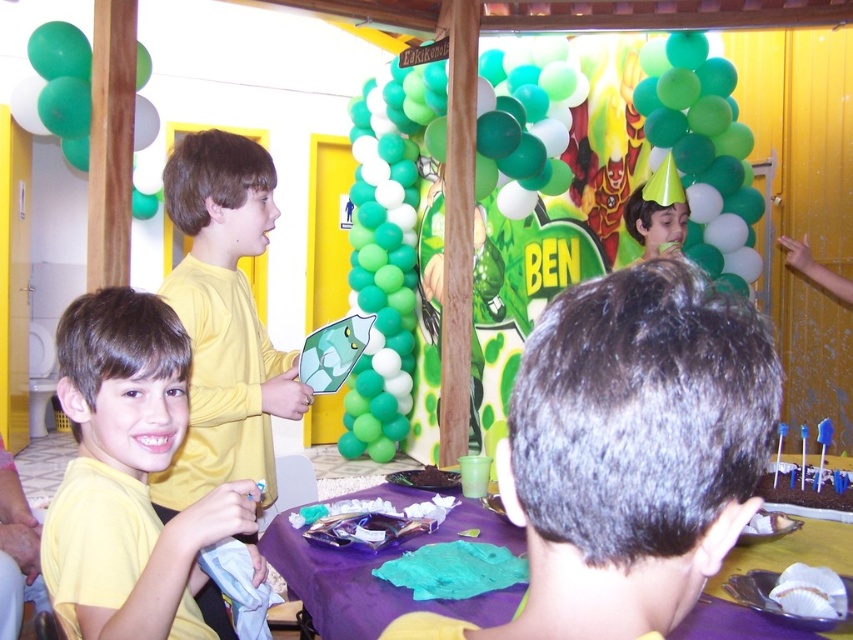
Question: Which of the following is the farthest from the observer?

Choices:
 (A) yellow matte shirt at lower left
 (B) green matte balloon at center
 (C) shiny yellow shirt at center

Answer: (B)

Question: Which of these objects is positioned closest to the purple fabric table at lower center?

Choices:
 (A) green matte balloon at upper right
 (B) shiny yellow shirt at center
 (C) yellow matte shirt at lower left
 (D) green matte balloon at center

Answer: (C)

Question: Estimate the real-world distances between objects in this image. Which object is closer to the shiny yellow shirt at center?

Choices:
 (A) green matte balloon at upper right
 (B) yellow matte shirt at lower left
 (C) purple fabric table at lower center
 (D) green matte balloon at center

Answer: (B)

Question: Where is shiny yellow shirt at center located in relation to yellow matte shirt at lower left in the image?

Choices:
 (A) left
 (B) right

Answer: (B)

Question: Is yellow matte shirt at lower left below green matte balloon at upper right?

Choices:
 (A) no
 (B) yes

Answer: (B)

Question: Can you confirm if yellow matte shirt at lower left is wider than green matte balloon at upper right?

Choices:
 (A) no
 (B) yes

Answer: (A)